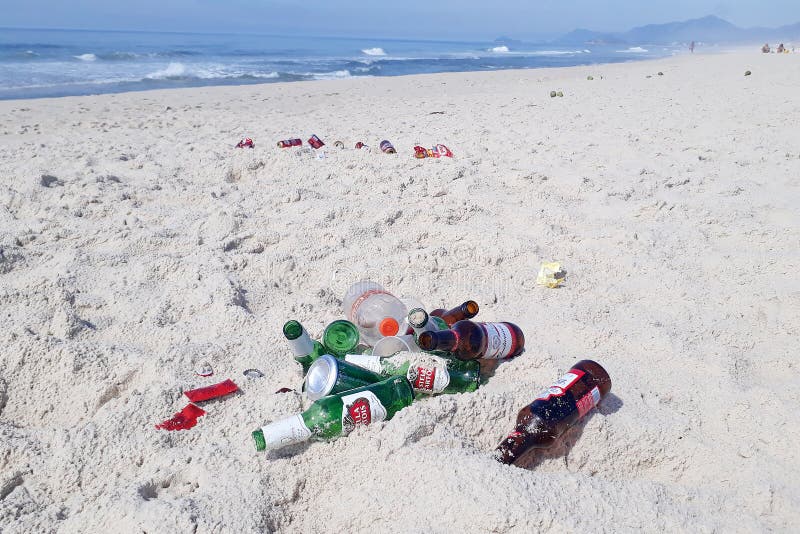
Find the location of a particular element. The width and height of the screenshot is (800, 534). bottles is located at coordinates (330, 402), (333, 364), (337, 335), (373, 321), (464, 333), (410, 364), (554, 418).